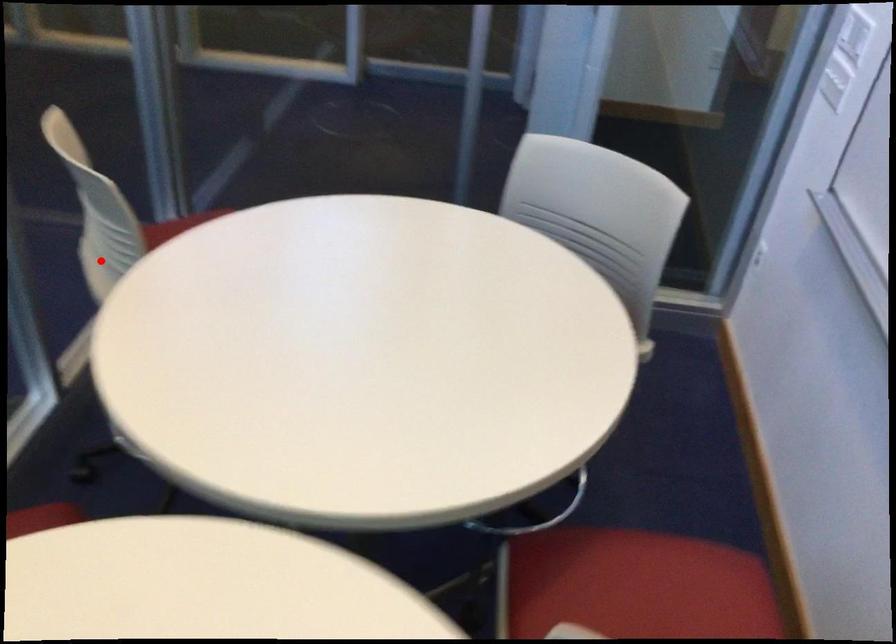
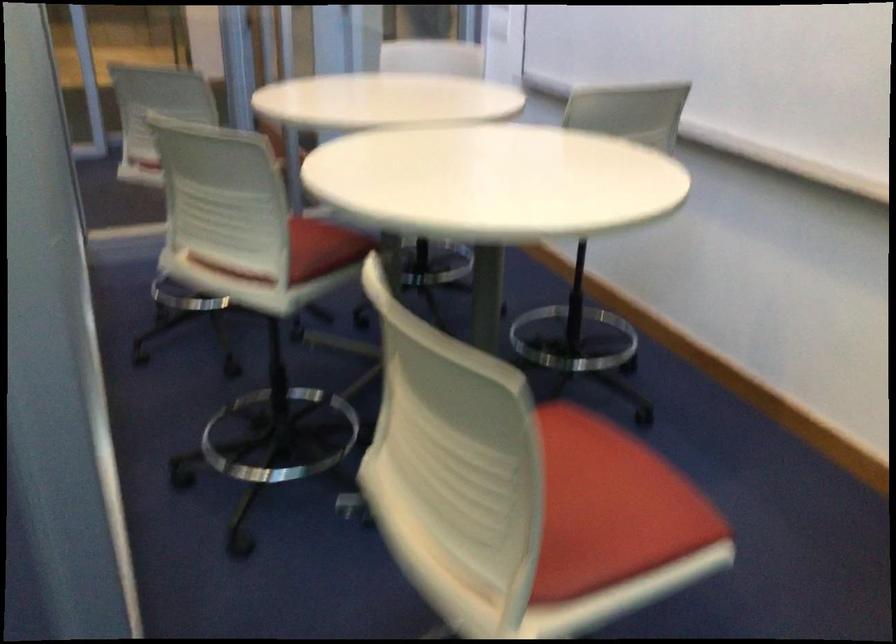
Question: A red point is marked in image1. In image2, is the corresponding 3D point closer to the camera or farther? Reply with the corresponding letter.

Choices:
 (A) The corresponding 3D point is closer.
 (B) The corresponding 3D point is farther.

Answer: (B)